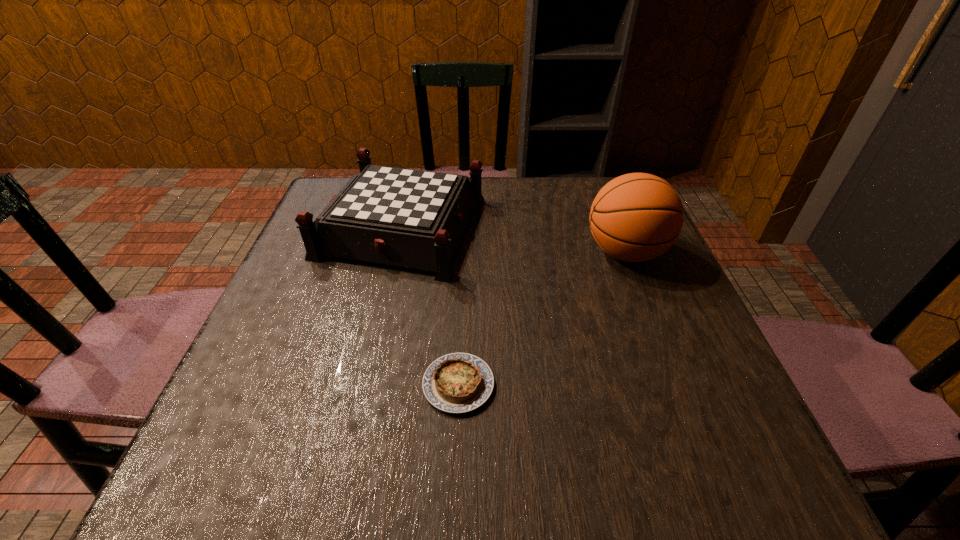
Locate an element on the screen. Image resolution: width=960 pixels, height=540 pixels. free space in the image that satisfies the following two spatial constraints: 1. on the front side of the second shortest object; 2. on the left side of the basketball is located at coordinates (396, 252).

Where is `vacant space that satisfies the following two spatial constraints: 1. on the back side of the nearest object; 2. on the right side of the tallest object`? vacant space that satisfies the following two spatial constraints: 1. on the back side of the nearest object; 2. on the right side of the tallest object is located at coordinates (464, 252).

This screenshot has height=540, width=960. Identify the location of free space that satisfies the following two spatial constraints: 1. on the back side of the basketball; 2. on the right side of the quiche. (464, 252).